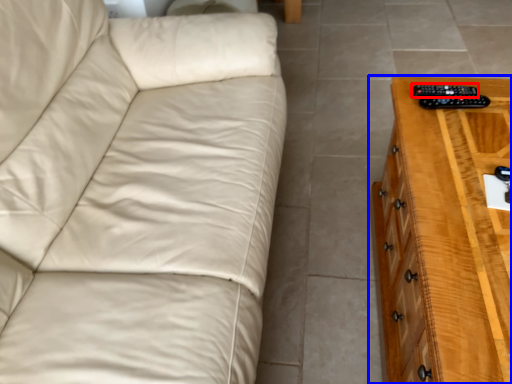
Question: Which of the following is the closest to the observer, remote (highlighted by a red box) or chest of drawers (highlighted by a blue box)?

Choices:
 (A) remote
 (B) chest of drawers

Answer: (B)